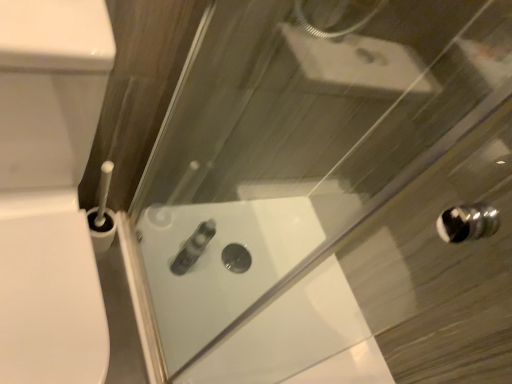
Question: From the image's perspective, is satin silver tube at center above or below white glossy toilet at left?

Choices:
 (A) below
 (B) above

Answer: (A)

Question: Choose the correct answer: Is satin silver tube at center inside white glossy toilet at left or outside it?

Choices:
 (A) outside
 (B) inside

Answer: (A)

Question: Which object is positioned closest to the white glossy bath at center?

Choices:
 (A) satin silver tube at center
 (B) white glossy toilet at left

Answer: (A)

Question: Considering the real-world distances, which object is farthest from the white glossy bath at center?

Choices:
 (A) satin silver tube at center
 (B) white glossy toilet at left

Answer: (B)